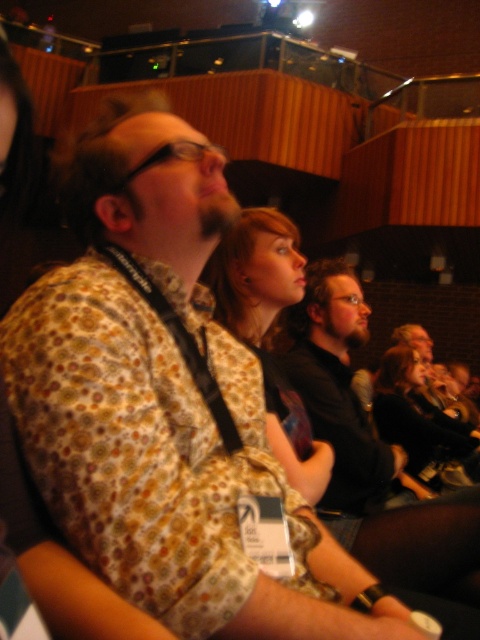
Question: Can you confirm if floral-patterned shirt at center is bigger than matte black jacket at center?

Choices:
 (A) yes
 (B) no

Answer: (B)

Question: Considering the real-world distances, which object is closest to the floral-patterned shirt at center?

Choices:
 (A) matte black jacket at center
 (B) dark brown leather jacket at center

Answer: (B)

Question: Does dark brown leather jacket at center appear under matte black jacket at center?

Choices:
 (A) yes
 (B) no

Answer: (B)

Question: Does dark brown leather jacket at center have a lesser width compared to floral-patterned shirt at center?

Choices:
 (A) no
 (B) yes

Answer: (A)

Question: Estimate the real-world distances between objects in this image. Which object is closer to the matte black jacket at center?

Choices:
 (A) floral-patterned shirt at center
 (B) dark brown leather jacket at center

Answer: (B)

Question: Among these points, which one is farthest from the camera?

Choices:
 (A) (356, 412)
 (B) (236, 310)
 (C) (409, 358)

Answer: (C)